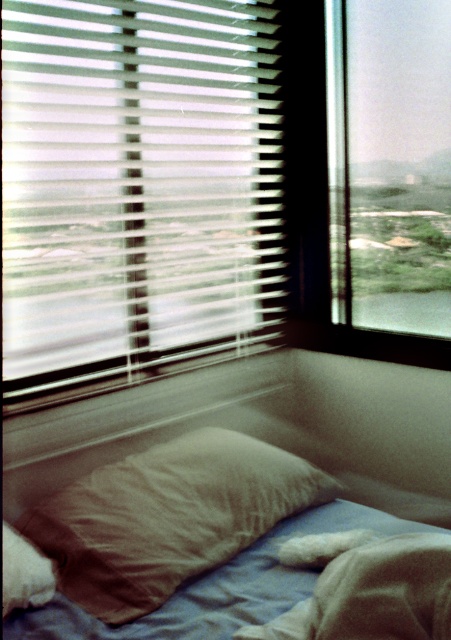
Between brown cotton pillow at center and blue cotton sheet at lower left, which one appears on the right side from the viewer's perspective?

Positioned to the right is blue cotton sheet at lower left.

Does brown cotton pillow at center have a larger size compared to blue cotton sheet at lower left?

Yes, brown cotton pillow at center is bigger than blue cotton sheet at lower left.

Where is `brown cotton pillow at center`? The height and width of the screenshot is (640, 451). brown cotton pillow at center is located at coordinates (168, 516).

Does point (366, 234) come in front of point (206, 497)?

No.

Is transparent glass window at upper right positioned in front of brown cotton pillow at center?

No, it is behind brown cotton pillow at center.

Locate an element on the screen. transparent glass window at upper right is located at coordinates (390, 173).

Which is more to the left, white translucent blinds at upper left or transparent glass window at upper right?

Positioned to the left is white translucent blinds at upper left.

Between white translucent blinds at upper left and transparent glass window at upper right, which one is positioned higher?

transparent glass window at upper right is higher up.

Locate an element on the screen. white translucent blinds at upper left is located at coordinates (138, 189).